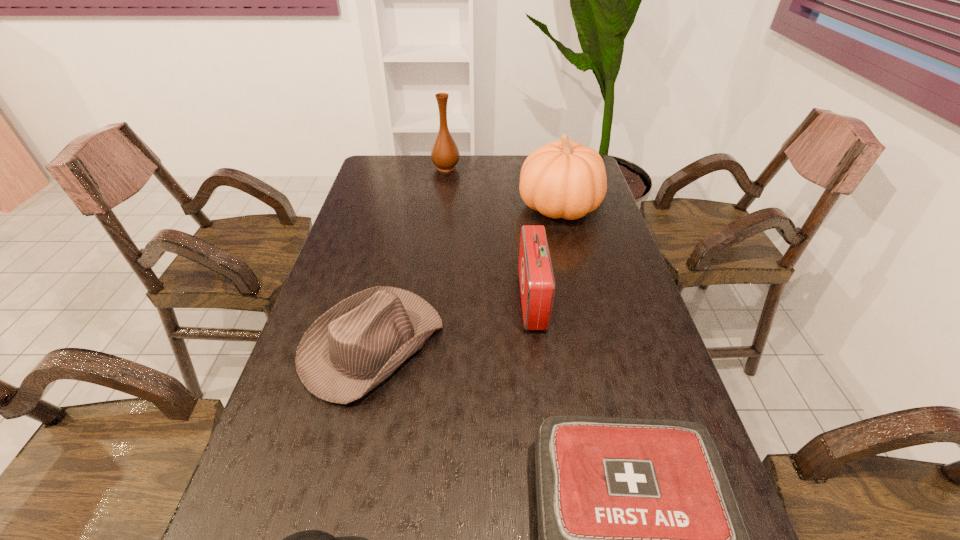
The width and height of the screenshot is (960, 540). I want to click on vase, so click(445, 155).

Image resolution: width=960 pixels, height=540 pixels. Find the location of `pumpkin`. pumpkin is located at coordinates (564, 179).

At what (x,y) coordinates should I click in order to perform the action: click on the farther first-aid kit. Please return your answer as a coordinate pair (x, y). This screenshot has height=540, width=960. Looking at the image, I should click on (537, 284).

Locate an element on the screen. The height and width of the screenshot is (540, 960). the third tallest object is located at coordinates (537, 284).

Locate an element on the screen. Image resolution: width=960 pixels, height=540 pixels. fedora is located at coordinates (357, 344).

Identify the location of free spot located 0.200m on the left of the vase. (381, 167).

In order to click on free space located on the left of the pumpkin in this screenshot , I will do `click(425, 207)`.

Find the location of `vacant space located 0.290m on the side of the fourth shortest object with the first aid cross symbol`. vacant space located 0.290m on the side of the fourth shortest object with the first aid cross symbol is located at coordinates (413, 300).

Identify the location of free space located on the side of the fourth shortest object with the first aid cross symbol. (398, 300).

What are the coordinates of `vacant area situated on the side of the fourth shortest object with the first aid cross symbol` in the screenshot? It's located at (465, 300).